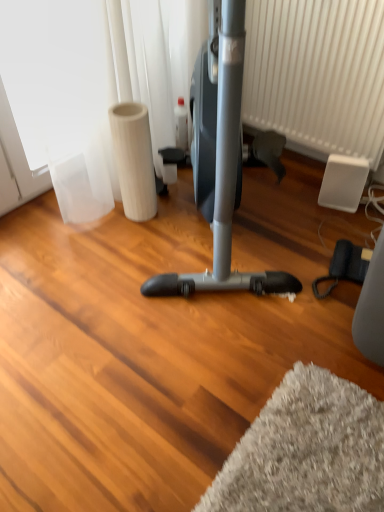
Question: Should I look upward or downward to see white textured radiator at center?

Choices:
 (A) down
 (B) up

Answer: (B)